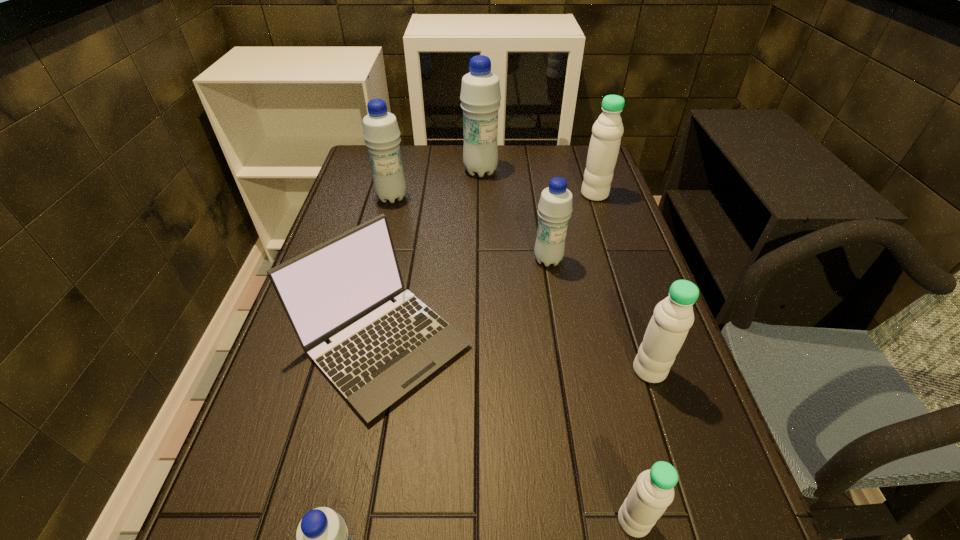
The image size is (960, 540). I want to click on the farthest object, so tap(480, 96).

The image size is (960, 540). I want to click on the third water bottle from left to right, so 480,96.

Where is `the farthest white water bottle`? This screenshot has width=960, height=540. the farthest white water bottle is located at coordinates (607, 131).

Identify the location of the second biggest blue water bottle. This screenshot has width=960, height=540. (381, 133).

At what (x,y) coordinates should I click in order to perform the action: click on the fourth water bottle from left to right. Please return your answer as a coordinate pair (x, y). The width and height of the screenshot is (960, 540). Looking at the image, I should click on (555, 206).

Locate an element on the screen. the fifth object from left to right is located at coordinates (555, 206).

Where is `the fifth farthest water bottle`? This screenshot has width=960, height=540. the fifth farthest water bottle is located at coordinates (673, 317).

Locate an element on the screen. the second nearest white water bottle is located at coordinates (673, 317).

Find the location of a particular element. laptop_computer is located at coordinates (341, 290).

Locate an element on the screen. This screenshot has width=960, height=540. the second nearest water bottle is located at coordinates (653, 491).